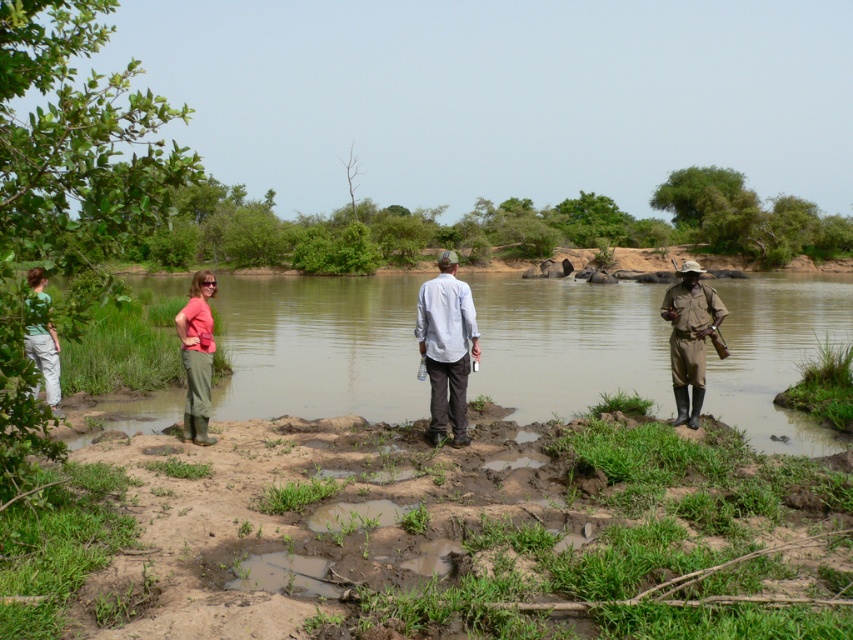
Who is positioned more to the left, green grassy river at center or brown uniform at center?

Positioned to the left is green grassy river at center.

Does green grassy river at center appear over brown uniform at center?

Indeed, green grassy river at center is positioned over brown uniform at center.

I want to click on green grassy river at center, so click(x=318, y=348).

The image size is (853, 640). Find the location of `green grassy river at center`. green grassy river at center is located at coordinates (318, 348).

Where is `green grassy river at center`? green grassy river at center is located at coordinates (318, 348).

Can you confirm if brown uniform at center is positioned to the right of green fabric shirt at left?

Correct, you'll find brown uniform at center to the right of green fabric shirt at left.

Which is below, brown uniform at center or green fabric shirt at left?

green fabric shirt at left is below.

Does point (689, 268) lie behind point (53, 416)?

That is True.

Find the location of a particular element. The width and height of the screenshot is (853, 640). brown uniform at center is located at coordinates (689, 337).